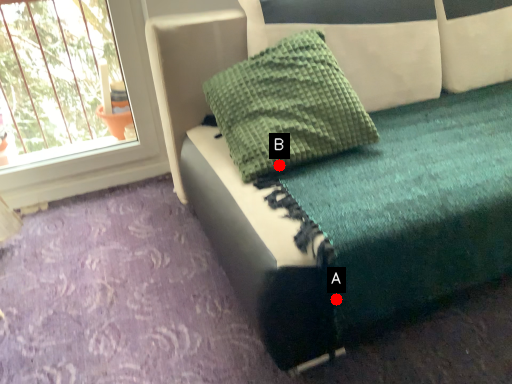
Question: Two points are circled on the image, labeled by A and B beside each circle. Which of the following is the farthest from the observer?

Choices:
 (A) A is further
 (B) B is further

Answer: (B)